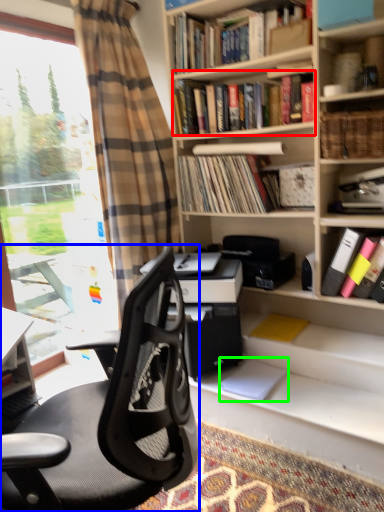
Question: Which object is the farthest from book (highlighted by a red box)? Choose among these: chair (highlighted by a blue box) or paperback book (highlighted by a green box).

Choices:
 (A) chair
 (B) paperback book

Answer: (A)